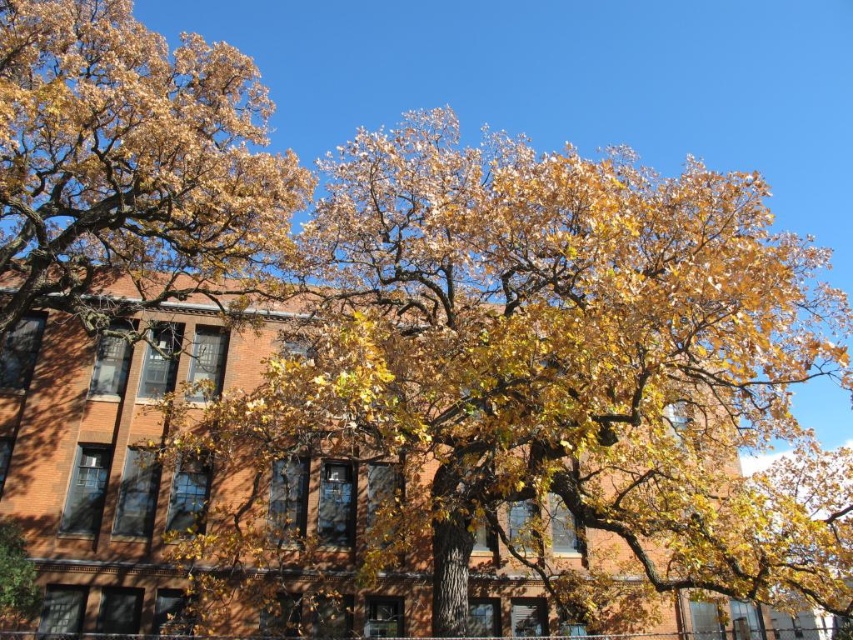
You are standing in an autumn park and see the yellow leafy oak tree at left and the yellow leafy tree at upper left. Which tree would block your view of the sky if you were standing directly in front of them?

The yellow leafy oak tree at left is taller than the yellow leafy tree at upper left, so it would block your view of the sky more completely.

You are standing in an autumn park and see the yellow leafy oak tree at left and the yellow leafy tree at upper left. Which tree is positioned more to the left side of the scene?

The yellow leafy tree at upper left is positioned more to the left side of the scene than the yellow leafy oak tree at left.

You are standing in the autumn scene and want to take a photo of both the yellow leafy oak tree at left and the yellow leafy tree at upper left. Which tree should you focus on first if you want to capture both in the same frame without moving your camera?

You should focus on the yellow leafy oak tree at left first because it is larger in size than the yellow leafy tree at upper left, allowing you to frame it properly while still including the smaller tree in the background or periphery.